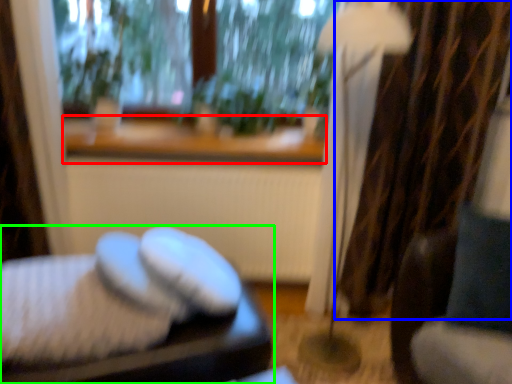
Question: Which object is positioned farthest from window sill (highlighted by a red box)? Select from curtain (highlighted by a blue box) and furniture (highlighted by a green box).

Choices:
 (A) curtain
 (B) furniture

Answer: (B)